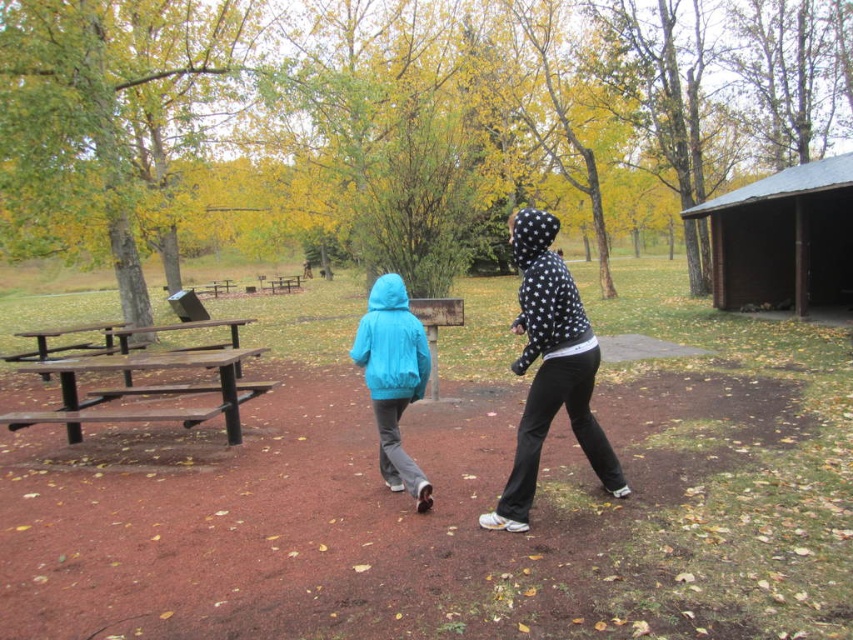
Question: Does polka dot hoodie at center appear on the left side of matte blue jacket at center?

Choices:
 (A) yes
 (B) no

Answer: (B)

Question: Does polka dot hoodie at center have a smaller size compared to matte blue jacket at center?

Choices:
 (A) yes
 (B) no

Answer: (B)

Question: Can you confirm if brown wooden shed at right is positioned above matte blue jacket at center?

Choices:
 (A) yes
 (B) no

Answer: (A)

Question: Considering the real-world distances, which object is closest to the brown wooden shed at right?

Choices:
 (A) polka dot hoodie at center
 (B) brown wooden picnic table at left

Answer: (A)

Question: Which object is closer to the camera taking this photo?

Choices:
 (A) matte blue jacket at center
 (B) polka dot hoodie at center

Answer: (B)

Question: Which object appears closest to the camera in this image?

Choices:
 (A) brown wooden shed at right
 (B) brown wooden picnic table at left
 (C) polka dot hoodie at center
 (D) matte blue jacket at center

Answer: (C)